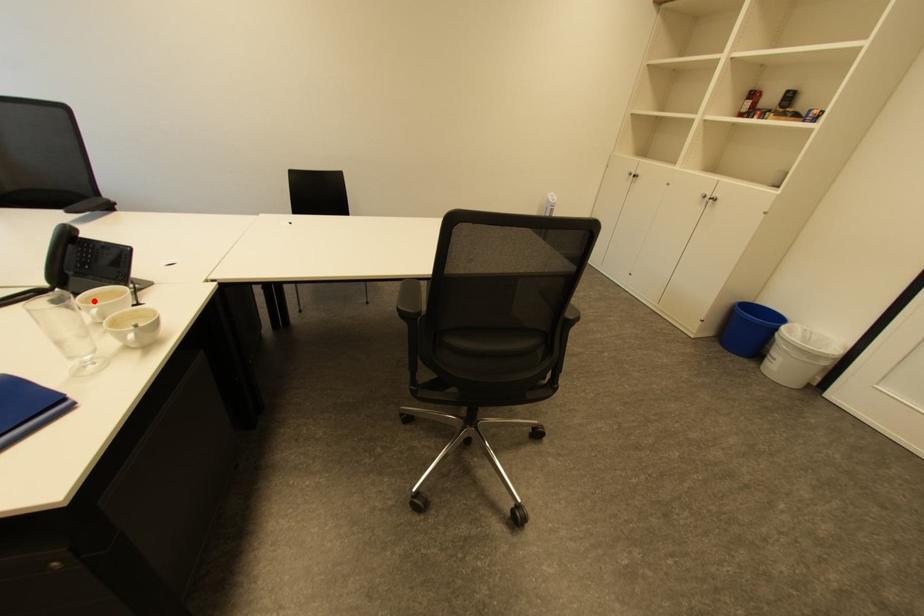
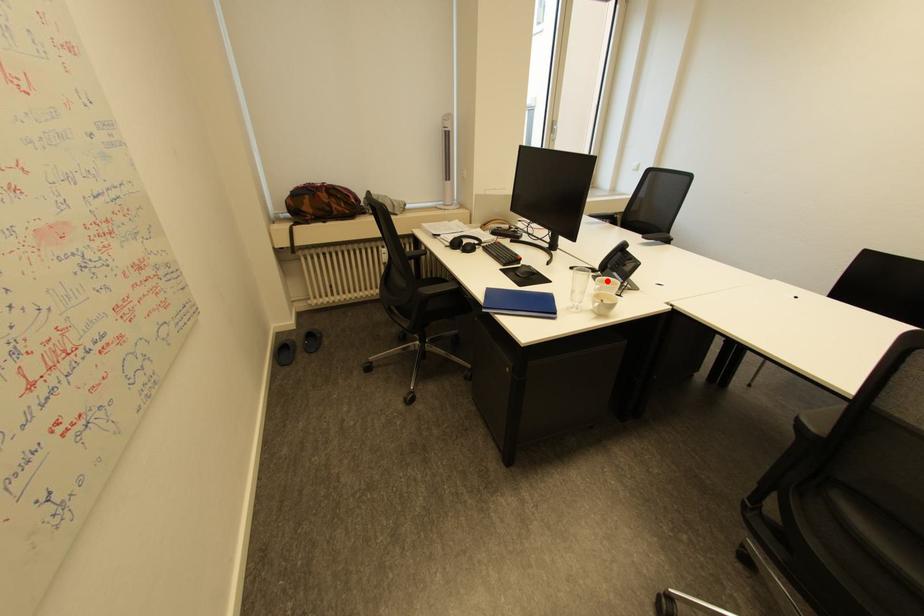
I am providing you with two images of the same scene from different viewpoints. A red point is marked on the first image and another point is marked on the second image. Does the point marked in image1 correspond to the same location as the one in image2?

Yes